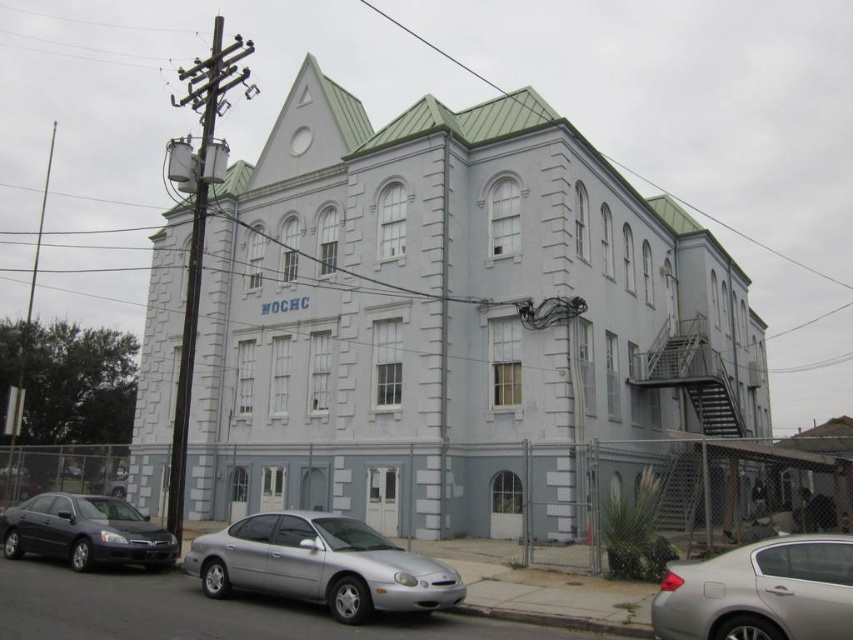
You are standing in front of the two story building and want to take a photo of both the silver metallic sedan at center and the shiny black sedan at lower left. Which sedan should you focus on first to ensure both are in frame?

You should focus on the silver metallic sedan at center first because it is closer to you than the shiny black sedan at lower left, so adjusting the camera to include both will require framing starting from the closer one.

You are driving a delivery van that is 20 feet long and need to park between the silver metallic sedan at center and the shiny black sedan at lower left. Is there enough space between them for your van?

The silver metallic sedan at center is 33.72 feet away from the shiny black sedan at lower left. Since your van is 20 feet long, there is sufficient space between them to park your van.

You are standing at the front entrance of the two story building and want to park your car in the closest available spot. The silver metallic sedan at center is blocking the path. What is the shortest distance you can go around the car to reach the parking spot?

The silver metallic sedan at center is positioned at point (321, 564). To go around it, you would need to detour either to the left or right side of the car, whichever is closer to the parking spot. However, without knowing the exact location of the parking spot, it is impossible to determine the shortest distance required to navigate around the car.